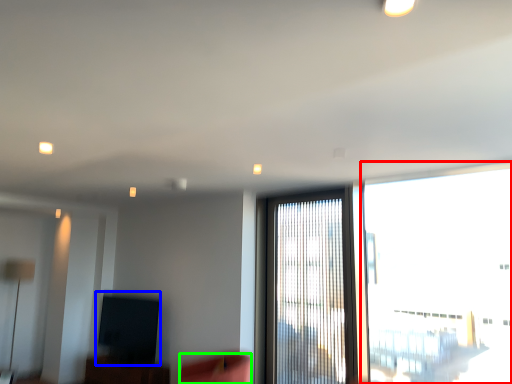
Question: Which is farther away from window (highlighted by a red box)? window screen (highlighted by a blue box) or swivel chair (highlighted by a green box)?

Choices:
 (A) window screen
 (B) swivel chair

Answer: (A)